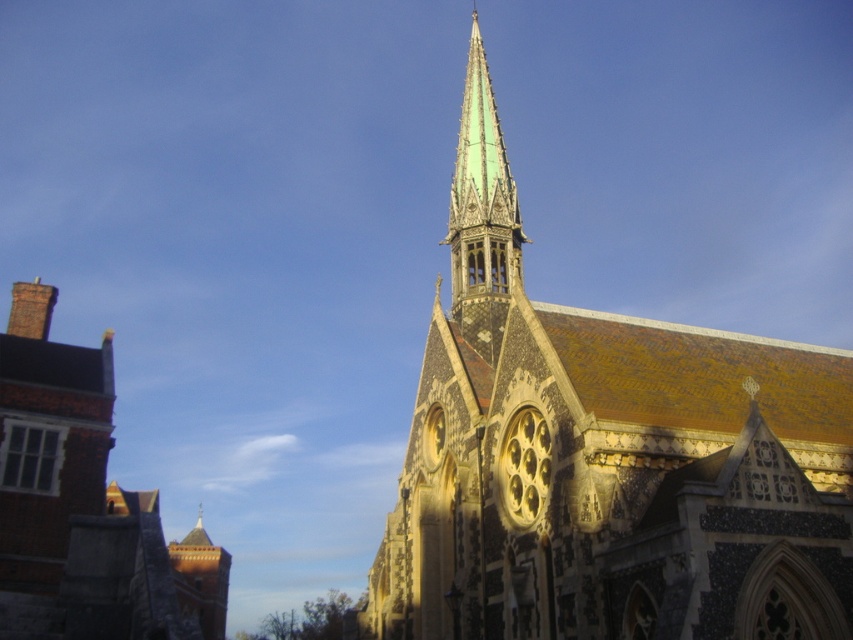
Question: Which point appears farthest from the camera in this image?

Choices:
 (A) (16, 401)
 (B) (639, 324)

Answer: (A)

Question: Does speckled stone church steeple at center have a smaller size compared to brick chimney at left?

Choices:
 (A) no
 (B) yes

Answer: (B)

Question: Which point is farther to the camera?

Choices:
 (A) (103, 556)
 (B) (828, 616)

Answer: (A)

Question: Does speckled stone church steeple at center have a greater width compared to brick chimney at left?

Choices:
 (A) no
 (B) yes

Answer: (A)

Question: Is speckled stone church steeple at center positioned behind brick chimney at left?

Choices:
 (A) no
 (B) yes

Answer: (A)

Question: Among these objects, which one is farthest from the camera?

Choices:
 (A) speckled stone church steeple at center
 (B) brick chimney at left

Answer: (B)